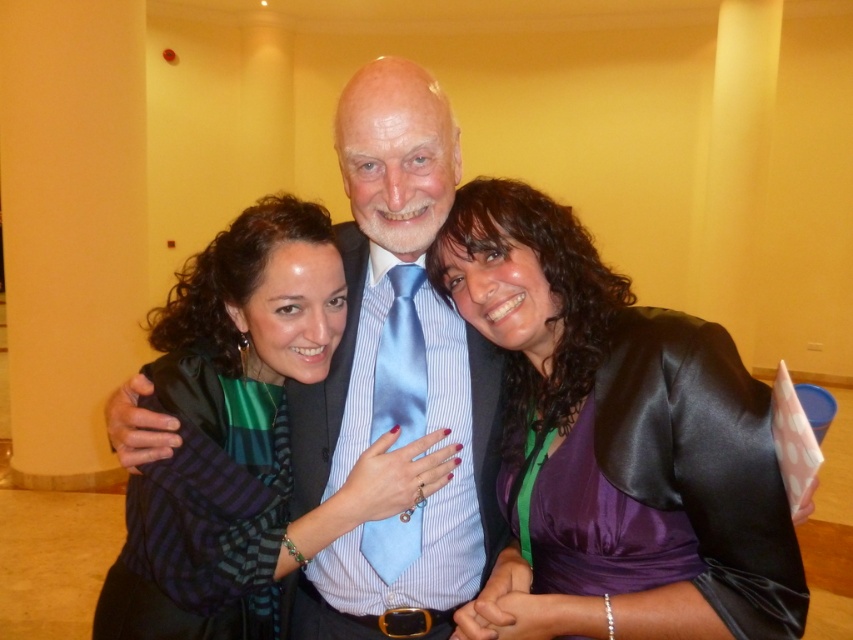
You are a photographer adjusting the camera focus. The camera can only focus on objects within 15 centimeters of each other. You see the satin purple dress at center and the blue satin tie at center in the frame. Will the camera be able to focus on both objects simultaneously?

The distance between the satin purple dress at center and the blue satin tie at center is 17.80 centimeters. Since the camera requires objects to be within 15 centimeters of each other to focus, the camera cannot focus on both objects simultaneously as the distance exceeds the limit.